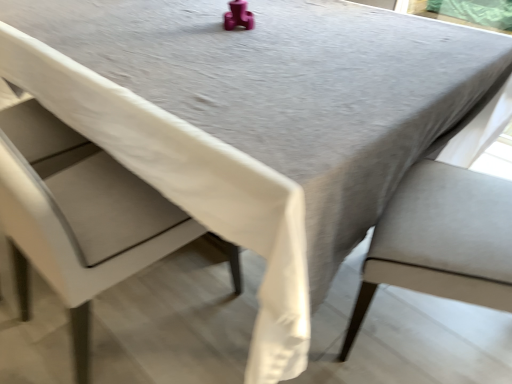
Question: Does satin beige chair at right, marked as the 1th chair in a right-to-left arrangement, turn towards white fabric chair at left, which is counted as the first chair, starting from the left?

Choices:
 (A) yes
 (B) no

Answer: (A)

Question: From a real-world perspective, is satin beige chair at right, marked as the 1th chair in a right-to-left arrangement, positioned under white fabric chair at left, which is counted as the first chair, starting from the left, based on gravity?

Choices:
 (A) yes
 (B) no

Answer: (A)

Question: Is satin beige chair at right, which appears as the second chair when viewed from the left, further to camera compared to white fabric chair at left, which is counted as the first chair, starting from the left?

Choices:
 (A) yes
 (B) no

Answer: (A)

Question: Does satin beige chair at right, which appears as the second chair when viewed from the left, have a lesser width compared to white fabric chair at left, which is counted as the first chair, starting from the left?

Choices:
 (A) yes
 (B) no

Answer: (A)

Question: Can you see satin beige chair at right, marked as the 1th chair in a right-to-left arrangement, touching white fabric chair at left, which is counted as the first chair, starting from the left?

Choices:
 (A) no
 (B) yes

Answer: (A)

Question: From a real-world perspective, is satin beige chair at right, marked as the 1th chair in a right-to-left arrangement, on top of white fabric chair at left, which is the second chair from right to left?

Choices:
 (A) no
 (B) yes

Answer: (A)

Question: From a real-world perspective, is white fabric chair at left, which is counted as the first chair, starting from the left, on top of satin beige chair at right, marked as the 1th chair in a right-to-left arrangement?

Choices:
 (A) no
 (B) yes

Answer: (B)

Question: Is white fabric chair at left, which is counted as the first chair, starting from the left, closer to the viewer compared to satin beige chair at right, which appears as the second chair when viewed from the left?

Choices:
 (A) no
 (B) yes

Answer: (B)

Question: Would you consider white fabric chair at left, which is counted as the first chair, starting from the left, to be distant from satin beige chair at right, marked as the 1th chair in a right-to-left arrangement?

Choices:
 (A) no
 (B) yes

Answer: (A)

Question: Does white fabric chair at left, which is the second chair from right to left, contain satin beige chair at right, which appears as the second chair when viewed from the left?

Choices:
 (A) no
 (B) yes

Answer: (A)

Question: From a real-world perspective, is white fabric chair at left, which is counted as the first chair, starting from the left, under satin beige chair at right, marked as the 1th chair in a right-to-left arrangement?

Choices:
 (A) no
 (B) yes

Answer: (A)

Question: Is white fabric chair at left, which is the second chair from right to left, thinner than satin beige chair at right, which appears as the second chair when viewed from the left?

Choices:
 (A) no
 (B) yes

Answer: (A)

Question: Visually, is satin beige chair at right, which appears as the second chair when viewed from the left, positioned to the left or to the right of white fabric chair at left, which is the second chair from right to left?

Choices:
 (A) right
 (B) left

Answer: (A)